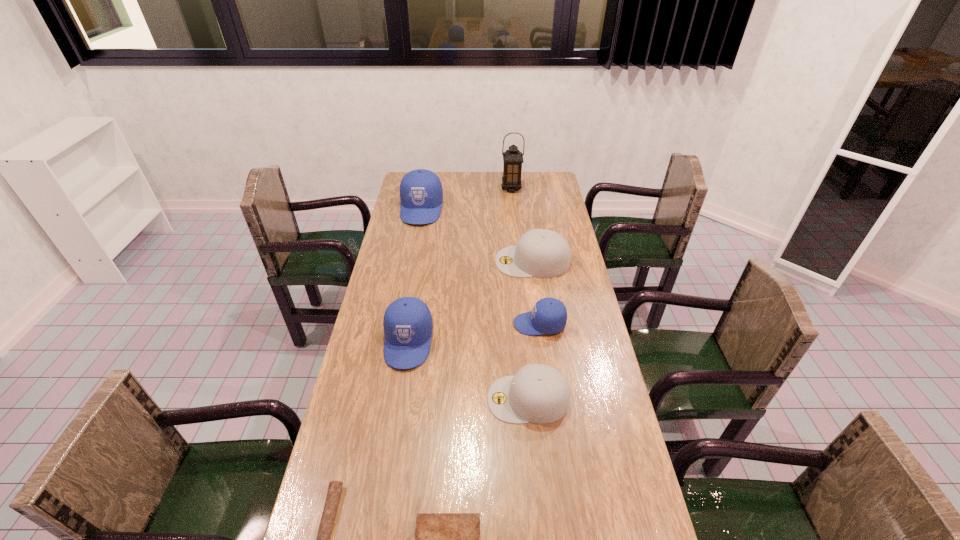
Locate which blue cap ranks third in proximity to the bigger gray cap. Please provide its 2D coordinates. Your answer should be formatted as a tuple, i.e. [(x, y)], where the tuple contains the x and y coordinates of a point satisfying the conditions above.

[(408, 326)]

You are a GUI agent. You are given a task and a screenshot of the screen. Output one action in this format:
    pyautogui.click(x=<x>, y=<y>)
    Task: Click on the gray cap object that ranks as the second closest to the tallest object
    
    Given the screenshot: What is the action you would take?
    click(x=538, y=393)

Locate which gray cap is the closest to the rightmost blue cap. Please provide its 2D coordinates. Your answer should be formatted as a tuple, i.e. [(x, y)], where the tuple contains the x and y coordinates of a point satisfying the conditions above.

[(538, 393)]